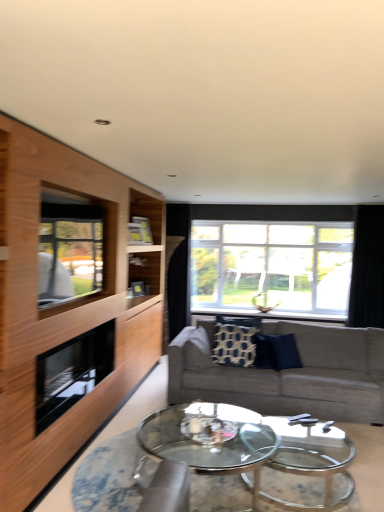
In order to face dark blue fabric pillow at center, which appears as the first pillow when viewed from the right, should I rotate leftwards or rightwards?

To face it directly, rotate right by 12.129 degrees.

What is the approximate width of black glass fireplace at left?

black glass fireplace at left is 18.34 inches in width.

The height and width of the screenshot is (512, 384). In order to click on patterned fabric pillow at center, which is the 1th pillow in left-to-right order in this screenshot , I will do `click(234, 345)`.

What do you see at coordinates (287, 373) in the screenshot?
I see `textured gray couch at center` at bounding box center [287, 373].

Identify the location of clear glass window at left, arranged as the first window when viewed from the front. Image resolution: width=384 pixels, height=512 pixels. (75, 247).

What do you see at coordinates (367, 268) in the screenshot? The width and height of the screenshot is (384, 512). I see `black velvet curtain at right` at bounding box center [367, 268].

This screenshot has height=512, width=384. What are the coordinates of `dark blue fabric pillow at center, placed as the second pillow when sorted from left to right` in the screenshot? It's located at (276, 352).

Which is more to the left, textured gray couch at center or transparent glass coffee table at center?

transparent glass coffee table at center.

Can you confirm if textured gray couch at center is shorter than transparent glass coffee table at center?

No, textured gray couch at center is not shorter than transparent glass coffee table at center.

This screenshot has width=384, height=512. In order to click on studio couch that is above the transparent glass coffee table at center (from a real-world perspective) in this screenshot , I will do `click(287, 373)`.

Is textured gray couch at center not near transparent glass coffee table at center?

No.

From their relative heights in the image, would you say transparent glass coffee table at center is taller or shorter than clear glass window at left, arranged as the first window when viewed from the front?

Considering their sizes, transparent glass coffee table at center has less height than clear glass window at left, arranged as the first window when viewed from the front.

Which object is wider, transparent glass coffee table at center or clear glass window at left, arranged as the first window when viewed from the left?

Wider between the two is transparent glass coffee table at center.

The image size is (384, 512). I want to click on coffee table below the clear glass window at left, placed as the 2th window when sorted from back to front (from a real-world perspective), so click(210, 439).

From the image's perspective, which is below, transparent glass coffee table at center or clear glass window at left, arranged as the first window when viewed from the front?

transparent glass coffee table at center, from the image's perspective.

Is wooden cabinet at left at the back of black velvet curtain at right?

No, black velvet curtain at right is not facing away from wooden cabinet at left.

Is the position of black velvet curtain at right less distant than that of wooden cabinet at left?

No, the depth of black velvet curtain at right is greater than that of wooden cabinet at left.

Is point (379, 300) behind point (30, 287)?

Yes.

From a real-world perspective, who is located higher, black velvet curtain at right or wooden cabinet at left?

In real-world perspective, black velvet curtain at right is above.

From a real-world perspective, which object stands above the other?

From a 3D spatial view, black velvet curtain at right is above.

From the image's perspective, between dark blue fabric pillow at center, placed as the second pillow when sorted from left to right, and black velvet curtain at right, who is located below?

dark blue fabric pillow at center, placed as the second pillow when sorted from left to right, appears lower in the image.

You are a GUI agent. You are given a task and a screenshot of the screen. Output one action in this format:
    pyautogui.click(x=<x>, y=<y>)
    Task: Click on the curtain above the dark blue fabric pillow at center, placed as the second pillow when sorted from left to right (from a real-world perspective)
    This screenshot has height=512, width=384.
    Given the screenshot: What is the action you would take?
    pyautogui.click(x=367, y=268)

Which object is wider, dark blue fabric pillow at center, which appears as the first pillow when viewed from the right, or black velvet curtain at right?

dark blue fabric pillow at center, which appears as the first pillow when viewed from the right.

Consider the image. Is transparent glass coffee table at center thinner than black velvet curtain at right?

No, transparent glass coffee table at center is not thinner than black velvet curtain at right.

From a real-world perspective, is transparent glass coffee table at center above or below black velvet curtain at right?

transparent glass coffee table at center is situated lower than black velvet curtain at right in the real world.

Considering their positions, is transparent glass coffee table at center located in front of or behind black velvet curtain at right?

transparent glass coffee table at center is positioned closer to the viewer than black velvet curtain at right.

Are transparent glass coffee table at center and black velvet curtain at right beside each other?

No, transparent glass coffee table at center is not touching black velvet curtain at right.

From a real-world perspective, between black glass fireplace at left and clear glass window at center, the second window when ordered from front to back, who is vertically higher?

In real-world perspective, clear glass window at center, the second window when ordered from front to back, is above.

Is black glass fireplace at left with clear glass window at center, which ranks as the first window in right-to-left order?

No, black glass fireplace at left is not beside clear glass window at center, which ranks as the first window in right-to-left order.

Could you tell me if black glass fireplace at left is turned towards clear glass window at center, marked as the 1th window in a back-to-front arrangement?

No, black glass fireplace at left is not aimed at clear glass window at center, marked as the 1th window in a back-to-front arrangement.

Which pillow is the 2nd one when counting from the left side of the black velvet curtain at right? Please provide its 2D coordinates.

[(234, 345)]

From the image's perspective, which is above, black velvet curtain at right or patterned fabric pillow at center, placed as the second pillow when sorted from right to left?

black velvet curtain at right is shown above in the image.

Consider the image. From their relative heights in the image, would you say black velvet curtain at right is taller or shorter than patterned fabric pillow at center, which is the 1th pillow in left-to-right order?

black velvet curtain at right is taller than patterned fabric pillow at center, which is the 1th pillow in left-to-right order.

You are a GUI agent. You are given a task and a screenshot of the screen. Output one action in this format:
    pyautogui.click(x=<x>, y=<y>)
    Task: Click on the coffee table on the left side of textured gray couch at center
    The height and width of the screenshot is (512, 384).
    Given the screenshot: What is the action you would take?
    pyautogui.click(x=210, y=439)

Which window is the 1st one when counting from the back of the transparent glass coffee table at center? Please provide its 2D coordinates.

[(75, 247)]

Considering their positions, is wooden cabinet at left positioned closer to patterned fabric pillow at center, which is the 1th pillow in left-to-right order, than black velvet curtain at right?

The object closer to patterned fabric pillow at center, which is the 1th pillow in left-to-right order, is black velvet curtain at right.

Looking at the image, which one is located closer to wooden cabinet at left, transparent glass coffee table at center or black velvet curtain at right?

Based on the image, transparent glass coffee table at center appears to be nearer to wooden cabinet at left.

Which object lies nearer to the anchor point textured gray couch at center, transparent glass coffee table at center or clear glass window at center, the second window when ordered from front to back?

transparent glass coffee table at center lies closer to textured gray couch at center than the other object.

Estimate the real-world distances between objects in this image. Which object is further from textured gray couch at center, dark blue fabric pillow at center, placed as the second pillow when sorted from left to right, or patterned fabric pillow at center, placed as the second pillow when sorted from right to left?

Among the two, dark blue fabric pillow at center, placed as the second pillow when sorted from left to right, is located further to textured gray couch at center.

Considering their positions, is transparent glass coffee table at center positioned further to clear glass window at left, placed as the 2th window when sorted from back to front, than wooden cabinet at left?

The object further to clear glass window at left, placed as the 2th window when sorted from back to front, is transparent glass coffee table at center.

Based on the photo, from the image, which object appears to be nearer to black glass fireplace at left, wooden cabinet at left or clear glass window at center, marked as the 1th window in a back-to-front arrangement?

wooden cabinet at left lies closer to black glass fireplace at left than the other object.

Considering their positions, is wooden cabinet at left positioned further to dark blue fabric pillow at center, placed as the second pillow when sorted from left to right, than clear glass window at center, which ranks as the second window in left-to-right order?

wooden cabinet at left is positioned further to the anchor dark blue fabric pillow at center, placed as the second pillow when sorted from left to right.

Looking at the image, which one is located further to clear glass window at left, which is the 2th window from right to left, wooden cabinet at left or textured gray couch at center?

The object further to clear glass window at left, which is the 2th window from right to left, is textured gray couch at center.

Identify the location of pillow situated between patterned fabric pillow at center, placed as the second pillow when sorted from right to left, and black velvet curtain at right from left to right. This screenshot has height=512, width=384. (276, 352).

Locate an element on the screen. The height and width of the screenshot is (512, 384). studio couch between wooden cabinet at left and dark blue fabric pillow at center, which appears as the first pillow when viewed from the right, in the front-back direction is located at coordinates (287, 373).

At what (x,y) coordinates should I click in order to perform the action: click on studio couch located between wooden cabinet at left and black velvet curtain at right in the depth direction. Please return your answer as a coordinate pair (x, y). The width and height of the screenshot is (384, 512). Looking at the image, I should click on (287, 373).

Image resolution: width=384 pixels, height=512 pixels. Identify the location of studio couch located between wooden cabinet at left and clear glass window at center, which ranks as the first window in right-to-left order, in the depth direction. (287, 373).